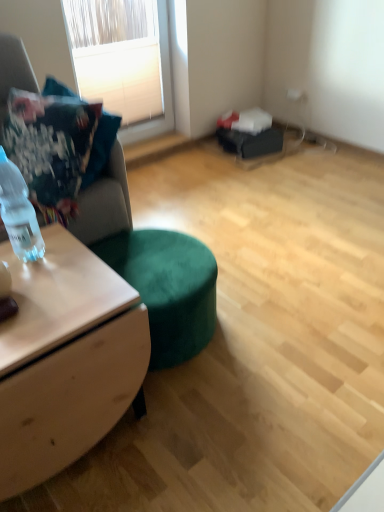
At what (x,y) coordinates should I click in order to perform the action: click on vacant area that is situated to the right of clear plastic bottle at left. Please return your answer as a coordinate pair (x, y). The width and height of the screenshot is (384, 512). Looking at the image, I should click on (73, 260).